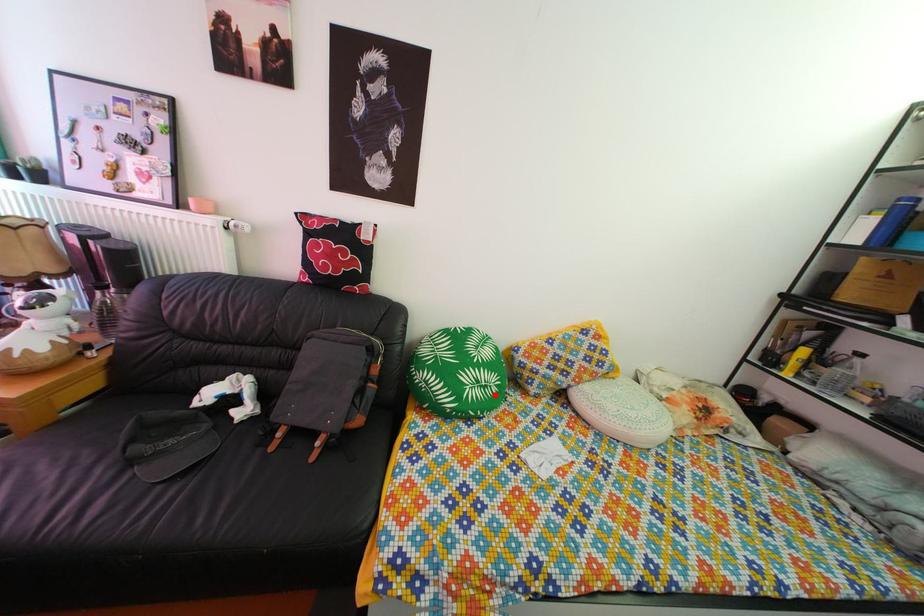
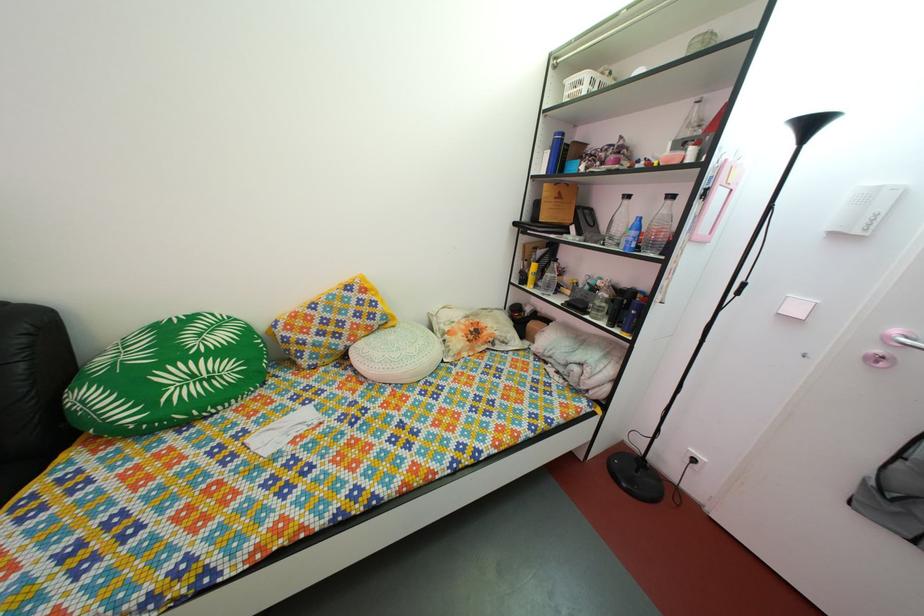
The point at the highlighted location is marked in the first image. Where is the corresponding point in the second image?

(220, 387)